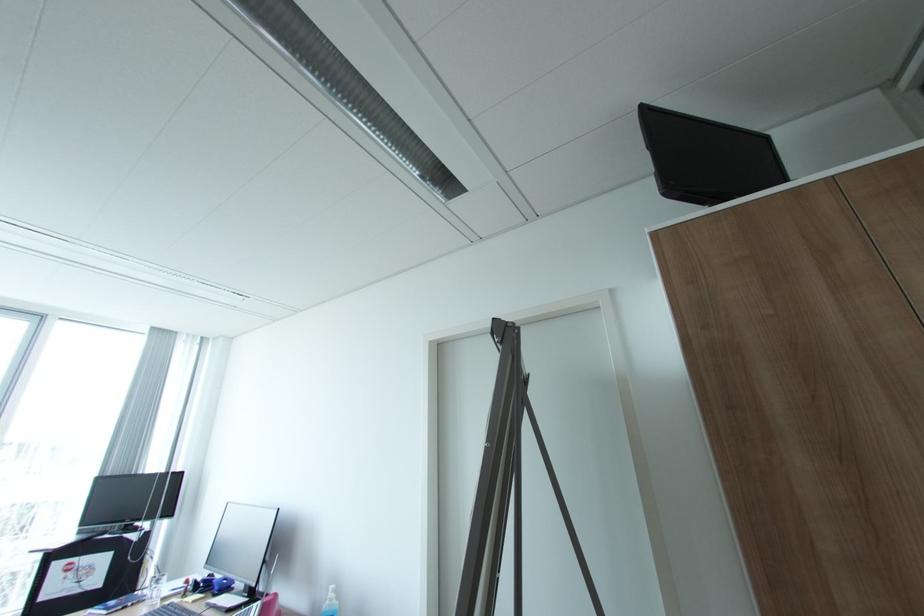
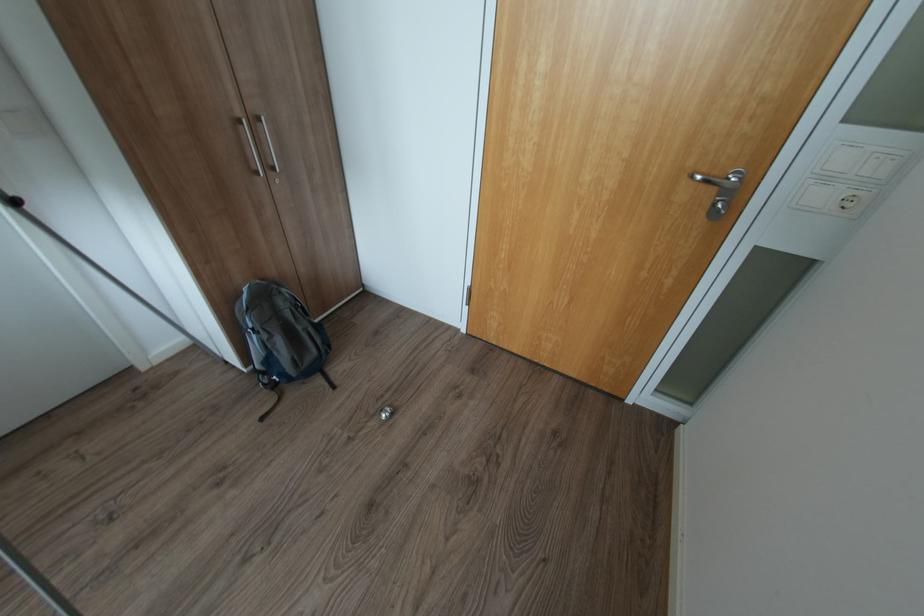
Based on the continuous images, in which direction is the camera rotating?

The camera's rotation is toward right-down.